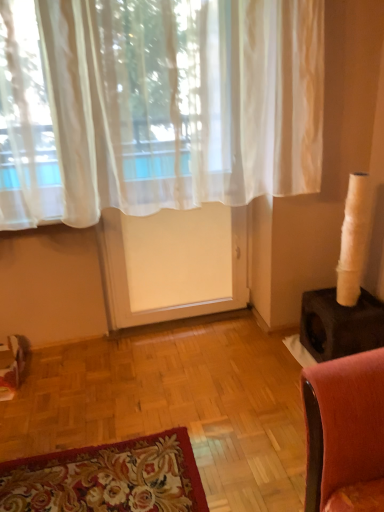
Locate an element on the screen. This screenshot has height=512, width=384. vacant space in sheer white curtain at upper center (from a real-world perspective) is located at coordinates (182, 362).